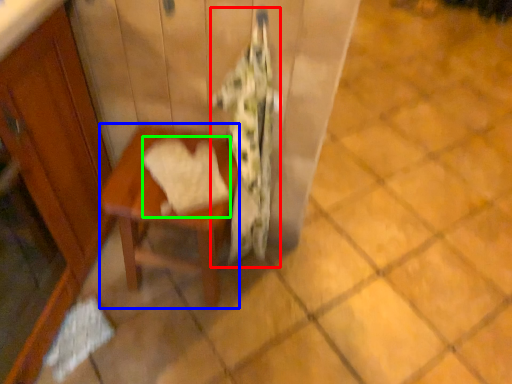
Question: Which is farther away from blanket (highlighted by a red box)? table (highlighted by a blue box) or bath towel (highlighted by a green box)?

Choices:
 (A) table
 (B) bath towel

Answer: (B)